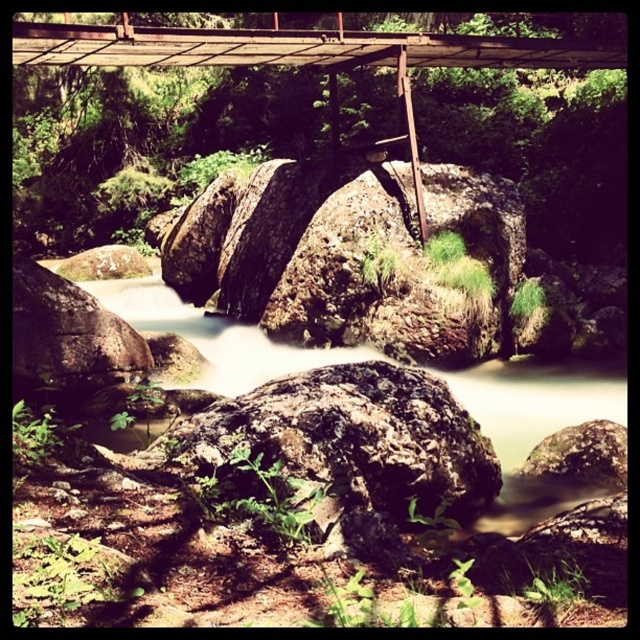
Is brown rock at center smaller than rusty metal bridge at upper center?

Incorrect, brown rock at center is not smaller in size than rusty metal bridge at upper center.

Which is behind, point (541, 486) or point (70, 61)?

The point (70, 61) is behind.

Who is more distant from viewer, (556,371) or (228,60)?

Point (228,60)

Identify the location of brown rock at center. (536, 428).